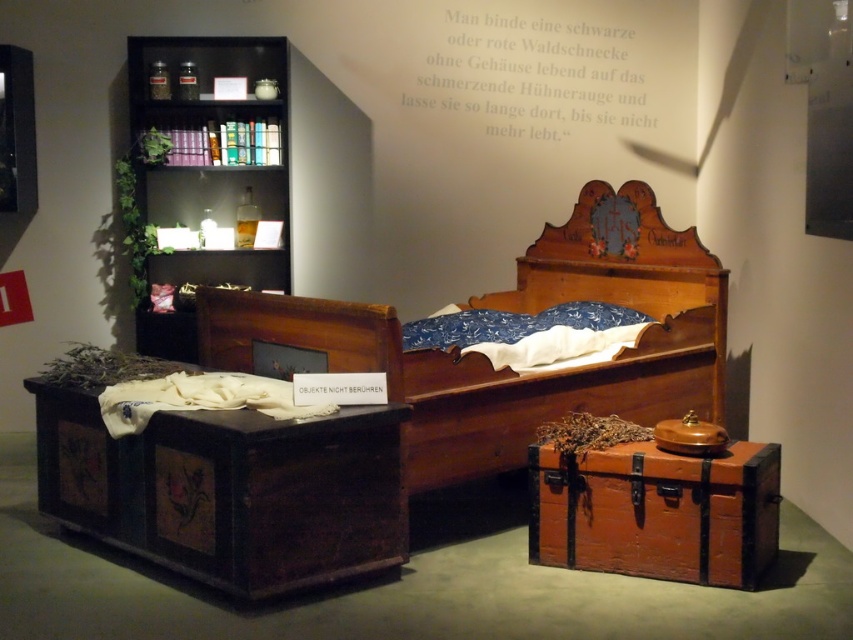
You are a visitor at the museum and want to take a photo of the wooden bed at center and the white paper at upper center. Which object will appear larger in your photo?

The wooden bed at center will appear larger in the photo because it is much taller than the white paper at upper center.

You are an interior designer planning to place a new decorative item between the wooden bookshelf at upper left and the blue fabric pillow at center. Considering their sizes, which object should you place the item closer to to ensure it doesn

The wooden bookshelf at upper left is larger than the blue fabric pillow at center, so placing the new decorative item closer to the wooden bookshelf at upper left would maintain a balanced arrangement.